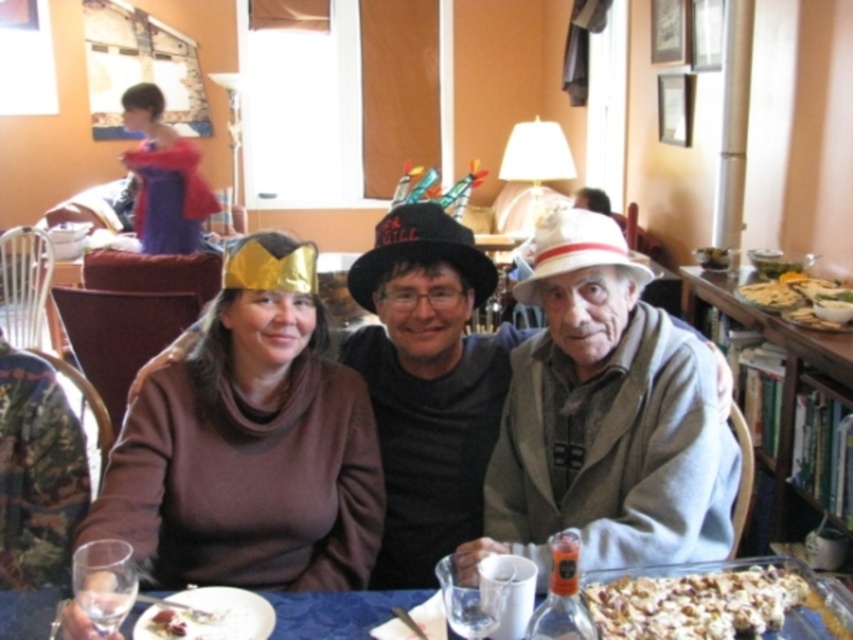
Does brown matte hat at left appear on the right side of crumbly brown popcorn at lower right?

In fact, brown matte hat at left is to the left of crumbly brown popcorn at lower right.

Find the location of a particular element. brown matte hat at left is located at coordinates (248, 458).

In order to click on brown matte hat at left in this screenshot , I will do click(248, 458).

Who is more forward, (405, 545) or (654, 602)?

Point (654, 602)

Which is more to the left, brown soft sweater at center or crumbly brown popcorn at lower right?

brown soft sweater at center is more to the left.

Image resolution: width=853 pixels, height=640 pixels. What are the coordinates of `brown soft sweater at center` in the screenshot? It's located at (427, 385).

Does brown matte hat at left have a lesser height compared to crusty bread at right?

In fact, brown matte hat at left may be taller than crusty bread at right.

Can you confirm if brown matte hat at left is positioned above crusty bread at right?

No.

Where is `brown matte hat at left`? brown matte hat at left is located at coordinates (248, 458).